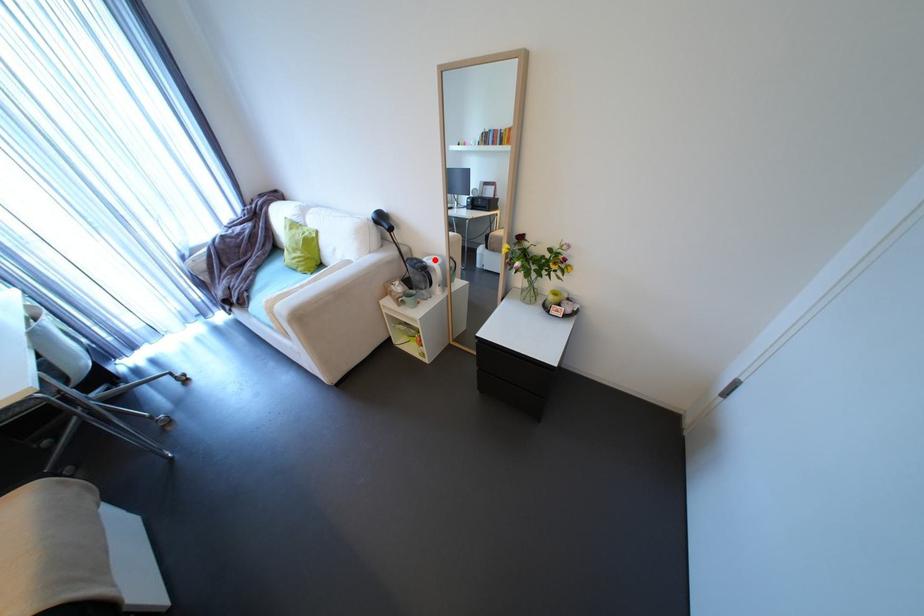
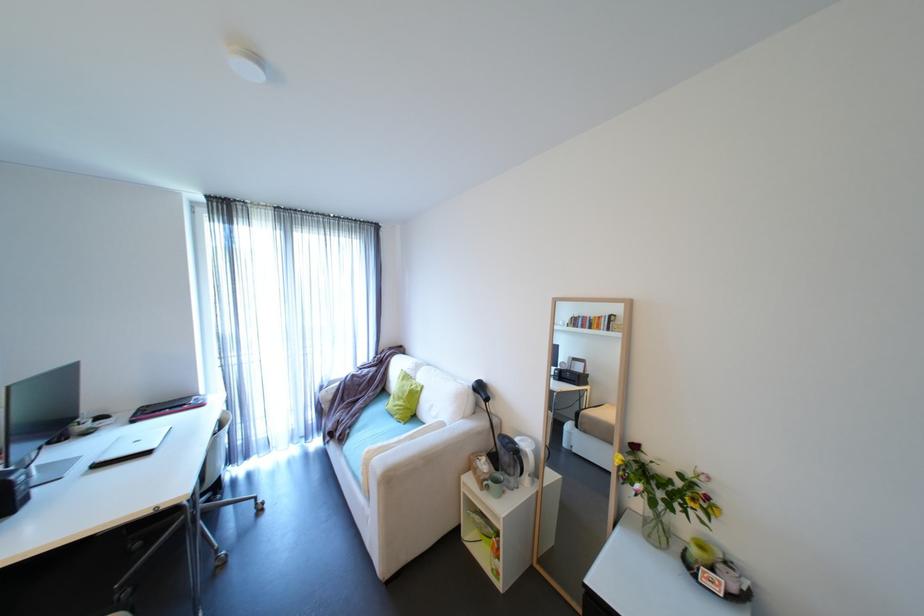
Find the pixel in the second image that matches the highlighted location in the first image.

(527, 440)